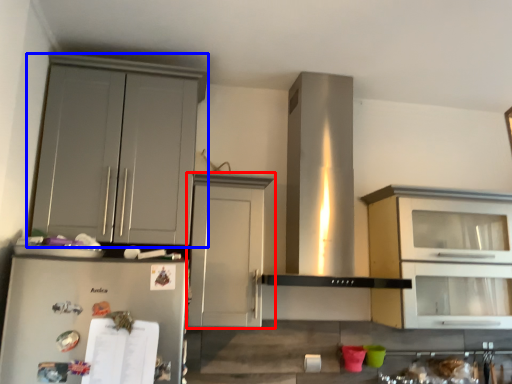
Question: Among these objects, which one is nearest to the camera, cabinetry (highlighted by a red box) or cabinetry (highlighted by a blue box)?

Choices:
 (A) cabinetry
 (B) cabinetry

Answer: (B)